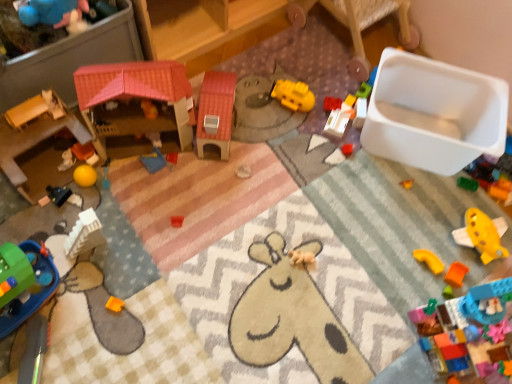
Locate an element on the screen. The height and width of the screenshot is (384, 512). free space between bright red plastic blocks at center, which ranks as the ninth toy in left-to-right order, and plastic pink house at center, positioned as the 9th toy in right-to-left order is located at coordinates (268, 129).